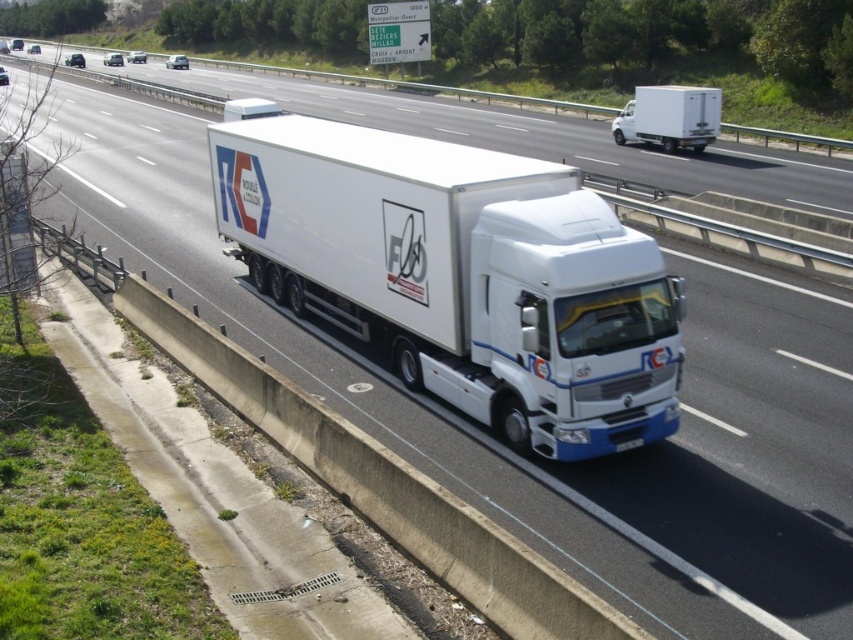
Question: Is white matte trailer truck at center above white matte truck at upper center?

Choices:
 (A) no
 (B) yes

Answer: (A)

Question: Among these objects, which one is farthest from the camera?

Choices:
 (A) white matte trailer truck at center
 (B) white matte truck at upper center
 (C) white glossy truck at center

Answer: (B)

Question: Which of the following is the closest to the observer?

Choices:
 (A) white matte trailer truck at center
 (B) white glossy truck at center
 (C) white matte truck at upper center

Answer: (A)

Question: Which is farther from the white matte trailer truck at center?

Choices:
 (A) white glossy truck at center
 (B) white matte truck at upper center

Answer: (B)

Question: Can you confirm if white matte trailer truck at center is smaller than white glossy truck at center?

Choices:
 (A) yes
 (B) no

Answer: (A)

Question: Is white matte trailer truck at center further to the viewer compared to white glossy truck at center?

Choices:
 (A) yes
 (B) no

Answer: (B)